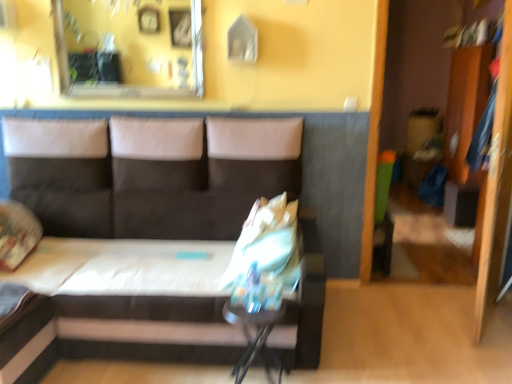
Question: Is clear glass mirror at upper center completely or partially inside dark gray fabric couch at center?

Choices:
 (A) no
 (B) yes

Answer: (A)

Question: From the image's perspective, is dark gray fabric couch at center under clear glass mirror at upper center?

Choices:
 (A) yes
 (B) no

Answer: (A)

Question: Is dark gray fabric couch at center taller than clear glass mirror at upper center?

Choices:
 (A) yes
 (B) no

Answer: (A)

Question: From a real-world perspective, does dark gray fabric couch at center sit lower than clear glass mirror at upper center?

Choices:
 (A) yes
 (B) no

Answer: (A)

Question: From the image's perspective, is dark gray fabric couch at center located above clear glass mirror at upper center?

Choices:
 (A) yes
 (B) no

Answer: (B)

Question: Could you tell me if dark gray fabric couch at center is facing clear glass mirror at upper center?

Choices:
 (A) no
 (B) yes

Answer: (A)

Question: Is clear glass mirror at upper center located within wooden dresser at right?

Choices:
 (A) no
 (B) yes

Answer: (A)

Question: From the image's perspective, is wooden dresser at right located above clear glass mirror at upper center?

Choices:
 (A) yes
 (B) no

Answer: (B)

Question: Does wooden dresser at right appear on the left side of clear glass mirror at upper center?

Choices:
 (A) yes
 (B) no

Answer: (B)

Question: Is wooden dresser at right outside of clear glass mirror at upper center?

Choices:
 (A) no
 (B) yes

Answer: (B)

Question: Does wooden dresser at right turn towards clear glass mirror at upper center?

Choices:
 (A) no
 (B) yes

Answer: (A)

Question: Does wooden dresser at right have a lesser height compared to clear glass mirror at upper center?

Choices:
 (A) no
 (B) yes

Answer: (A)

Question: Is clear glass mirror at upper center positioned before dark gray fabric couch at center?

Choices:
 (A) no
 (B) yes

Answer: (A)